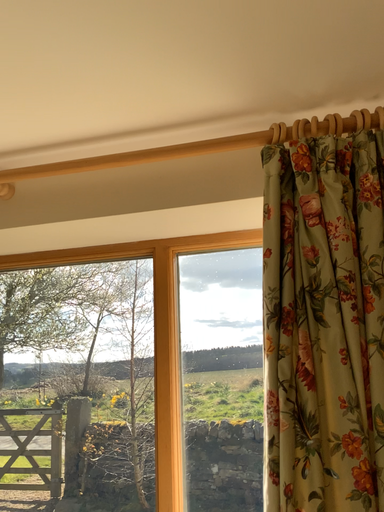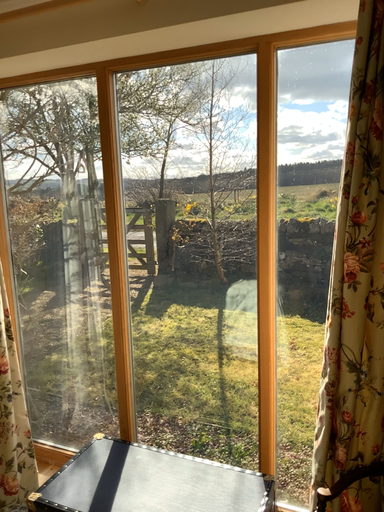
Question: How did the camera likely rotate when shooting the video?

Choices:
 (A) rotated right
 (B) rotated left

Answer: (B)